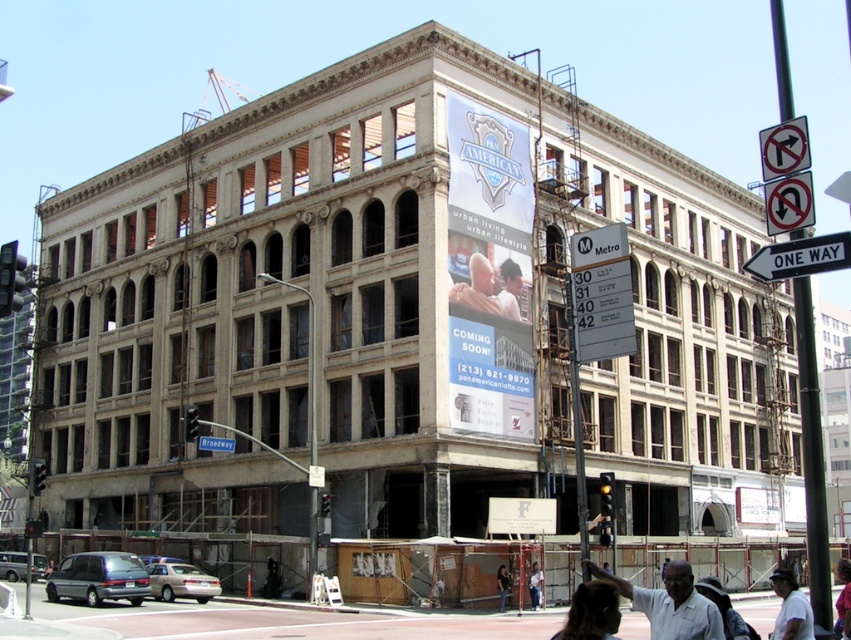
Question: Does white plastic sign at center lie behind white glossy billboard at upper center?

Choices:
 (A) no
 (B) yes

Answer: (B)

Question: Is white paper sign at upper right below blue metallic street sign at upper center?

Choices:
 (A) yes
 (B) no

Answer: (B)

Question: Does black metal pole at right have a lesser width compared to dark brown hair at lower center?

Choices:
 (A) no
 (B) yes

Answer: (A)

Question: Which object is the farthest from the light gray shirt at lower right?

Choices:
 (A) white cotton shirt at lower right
 (B) dark brown hair at lower center

Answer: (A)

Question: Which object is farther from the camera taking this photo?

Choices:
 (A) smooth beige shirt at center
 (B) white shirt at center
 (C) black metal pole at right

Answer: (A)

Question: Which object is positioned farthest from the white paper sign at center?

Choices:
 (A) white shirt at center
 (B) white paper sign at upper right
 (C) white glossy billboard at upper center

Answer: (C)